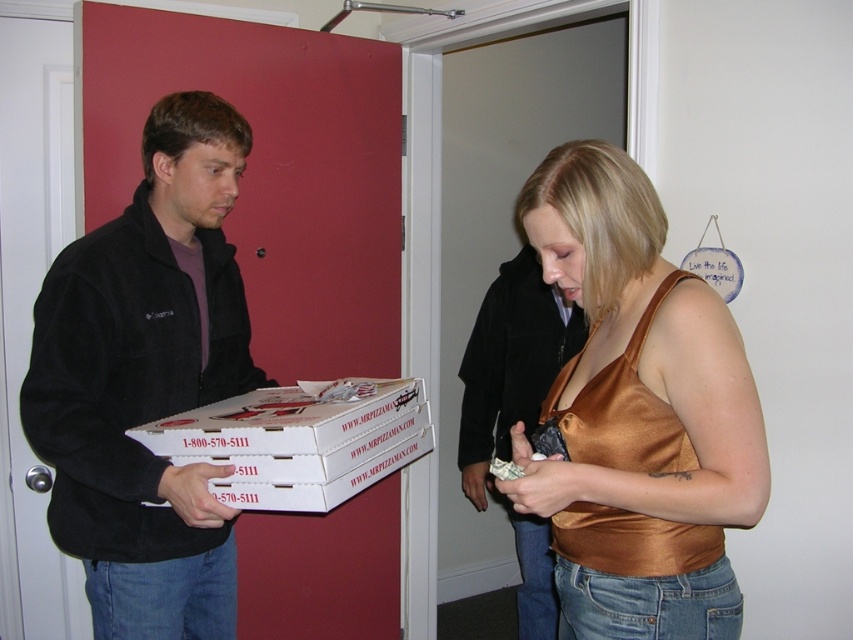
You are a delivery person who needs to place a package on a surface that is taller than the gold satin tank top at center. Is the white cardboard box at center a suitable surface for this?

The gold satin tank top at center is much taller than the white cardboard box at center, so the white cardboard box at center is not a suitable surface because it is shorter than the required height.

You are a delivery person trying to hand over three pizza boxes to the person in the gold satin tank top at center. The black fleece jacket at left is blocking your path. Is there enough space between them to pass through?

The distance between the gold satin tank top at center and the black fleece jacket at left is 25.76 inches, so there is enough space to pass through as 25.76 inches is greater than the required space for a person to move through.